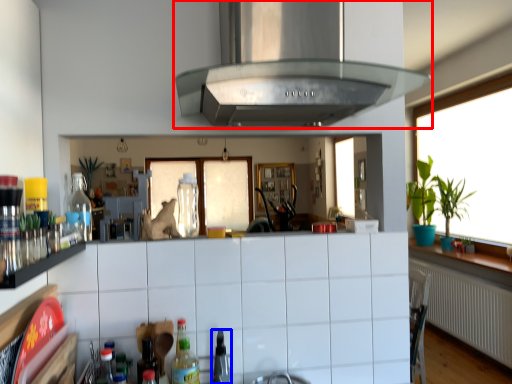
Question: Which point is further to the camera, exhaust hood (highlighted by a red box) or appliance (highlighted by a blue box)?

Choices:
 (A) exhaust hood
 (B) appliance

Answer: (B)